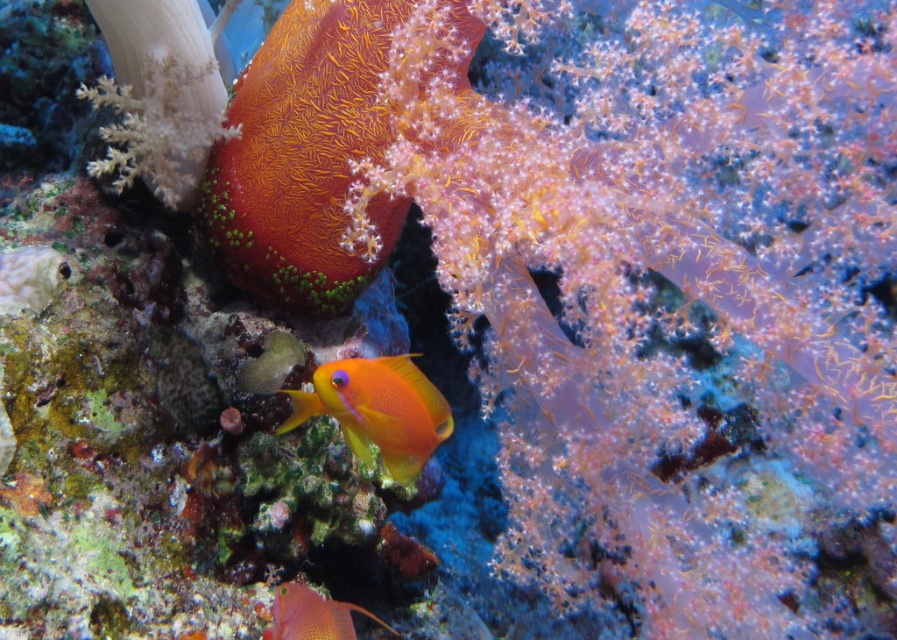
Question: Which point appears farthest from the camera in this image?

Choices:
 (A) (369, 362)
 (B) (292, 634)

Answer: (A)

Question: Among these points, which one is farthest from the camera?

Choices:
 (A) (405, 372)
 (B) (272, 604)

Answer: (B)

Question: In this image, where is orange matte fish at center located relative to orange glossy fish at center?

Choices:
 (A) right
 (B) left

Answer: (A)

Question: Among these objects, which one is farthest from the camera?

Choices:
 (A) orange matte fish at center
 (B) orange glossy fish at center

Answer: (B)

Question: Does orange matte fish at center appear under orange glossy fish at center?

Choices:
 (A) no
 (B) yes

Answer: (A)

Question: Can you confirm if orange matte fish at center is positioned below orange glossy fish at center?

Choices:
 (A) no
 (B) yes

Answer: (A)